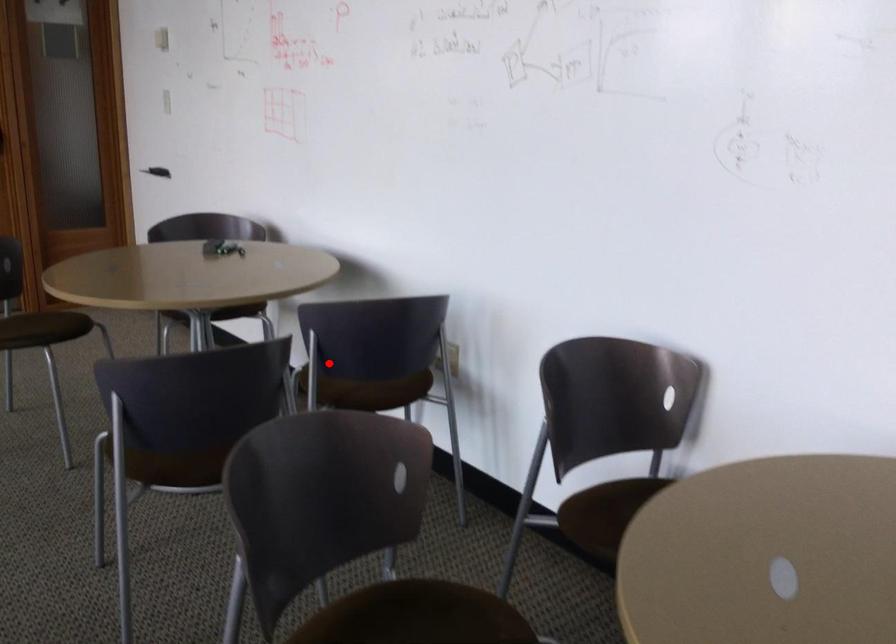
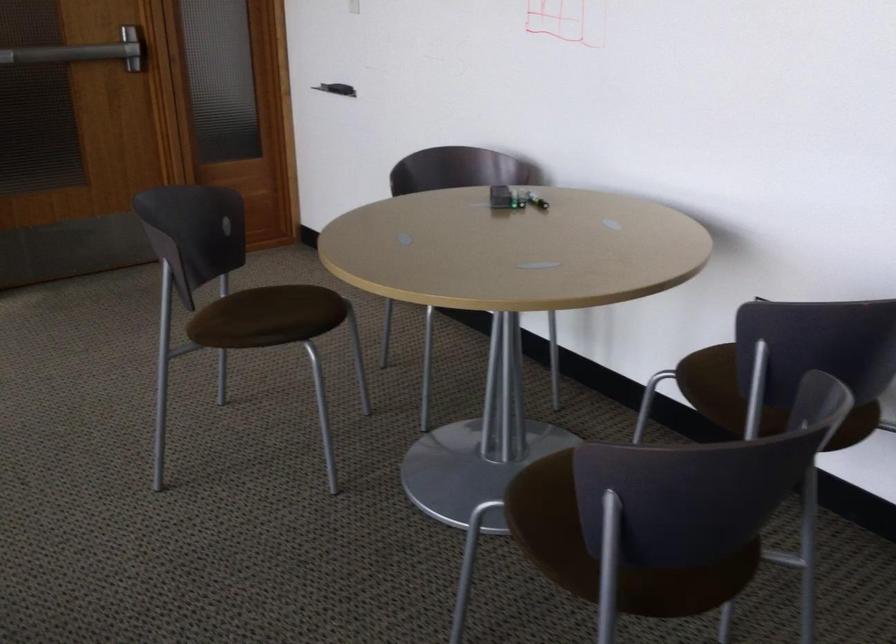
Find the pixel in the second image that matches the highlighted location in the first image.

(745, 386)